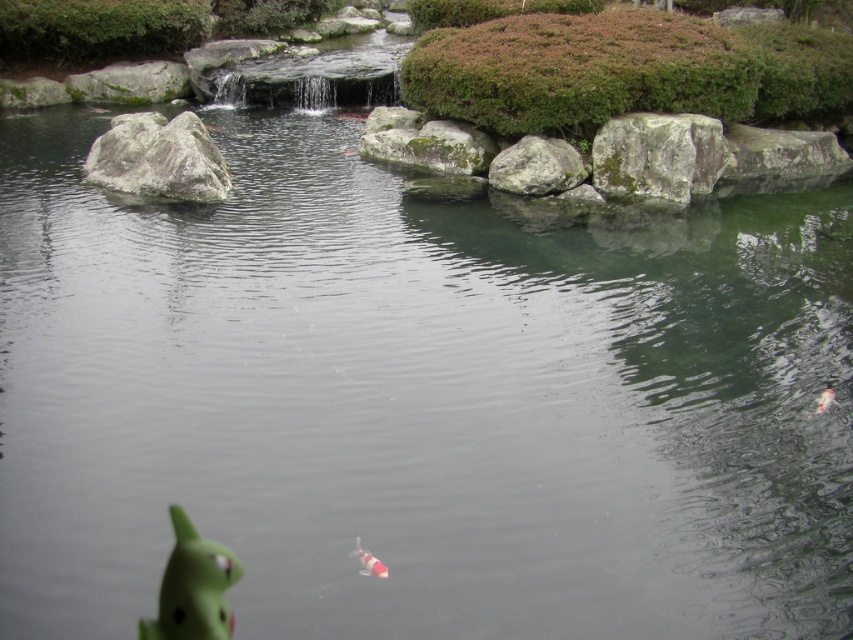
You are a small frog trying to jump from the gray rough rock at upper right to the white glossy fish at lower right. Considering their heights, will you land safely on the fish?

The gray rough rock at upper right has a greater height compared to the white glossy fish at lower right. Since the frog is jumping from a higher position, it will land safely on the fish.

You are a small frog trying to jump from the gray rough rock at left to the gray rough rock at center. Considering their sizes, which rock will give you a more stable landing?

The gray rough rock at left is bigger than the gray rough rock at center, so it provides a more stable landing surface for the frog.